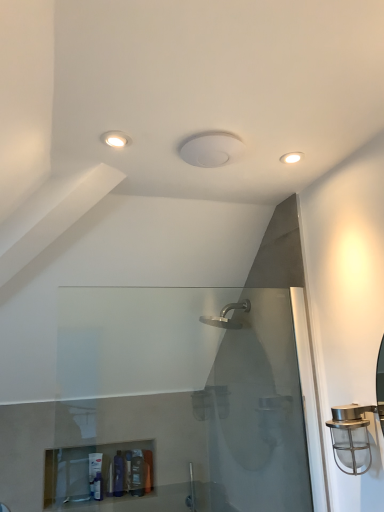
What do you see at coordinates (351, 438) in the screenshot? I see `metallic cage at right` at bounding box center [351, 438].

What do you see at coordinates (116, 139) in the screenshot? I see `matte white recessed light at upper left, which is the second light fixture from right to left` at bounding box center [116, 139].

Locate an element on the screen. The image size is (384, 512). translucent plastic bottle at lower center, the first toiletry from the right is located at coordinates (148, 470).

Locate an element on the screen. metallic cage at right is located at coordinates (351, 438).

Between matte white recessed light at upper left, which is the 2th light fixture in back-to-front order, and translucent plastic tube at lower center, the second toiletry positioned from the left, which one has larger size?

With larger size is translucent plastic tube at lower center, the second toiletry positioned from the left.

You are a GUI agent. You are given a task and a screenshot of the screen. Output one action in this format:
    pyautogui.click(x=<x>, y=<y>)
    Task: Click on the 1st toiletry behind the matte white recessed light at upper left, which ranks as the first light fixture in front-to-back order
    This screenshot has width=384, height=512.
    Given the screenshot: What is the action you would take?
    pyautogui.click(x=137, y=473)

Does point (110, 139) come farther from viewer compared to point (139, 492)?

That is False.

Is white matte light fixture at upper right, arranged as the 2th light fixture when viewed from the front, wider or thinner than translucent plastic bottle at lower center, the 3th toiletry positioned from the left?

In the image, white matte light fixture at upper right, arranged as the 2th light fixture when viewed from the front, appears to be more narrow than translucent plastic bottle at lower center, the 3th toiletry positioned from the left.

Which point is more distant from viewer, (292, 154) or (149, 463)?

The point (149, 463) is farther.

Who is more distant, white matte light fixture at upper right, which appears as the 2th light fixture when viewed from the left, or translucent plastic bottle at lower center, the 3th toiletry positioned from the left?

translucent plastic bottle at lower center, the 3th toiletry positioned from the left.

Looking at this image, from the image's perspective, is translucent plastic tube at lower center, the second toiletry positioned from the left, located above translucent plastic bottle at lower center, the 3th toiletry positioned from the left?

Yes, from the image's perspective, translucent plastic tube at lower center, the second toiletry positioned from the left, is on top of translucent plastic bottle at lower center, the 3th toiletry positioned from the left.

Identify the location of toiletry below the translucent plastic bottle at lower center, the first toiletry from the right (from a real-world perspective). (137, 473).

Considering the sizes of translucent plastic tube at lower center, which is the 2th toiletry from right to left, and translucent plastic bottle at lower center, the first toiletry from the right, in the image, is translucent plastic tube at lower center, which is the 2th toiletry from right to left, wider or thinner than translucent plastic bottle at lower center, the first toiletry from the right,?

translucent plastic tube at lower center, which is the 2th toiletry from right to left, is thinner than translucent plastic bottle at lower center, the first toiletry from the right.

Based on the photo, which is closer, (x=139, y=478) or (x=144, y=483)?

Point (x=139, y=478) is farther from the camera than point (x=144, y=483).

Is matte white recessed light at upper left, which is the 2th light fixture in back-to-front order, completely or partially inside white matte light fixture at upper right, which is the 1th light fixture in back-to-front order?

That's incorrect, matte white recessed light at upper left, which is the 2th light fixture in back-to-front order, is not inside white matte light fixture at upper right, which is the 1th light fixture in back-to-front order.

Can you tell me how much white matte light fixture at upper right, which appears as the 2th light fixture when viewed from the left, and matte white recessed light at upper left, which is the 2th light fixture in back-to-front order, differ in facing direction?

0.688 degrees separate the facing orientations of white matte light fixture at upper right, which appears as the 2th light fixture when viewed from the left, and matte white recessed light at upper left, which is the 2th light fixture in back-to-front order.

Who is shorter, white matte light fixture at upper right, placed as the first light fixture when sorted from right to left, or matte white recessed light at upper left, which is the second light fixture from right to left?

white matte light fixture at upper right, placed as the first light fixture when sorted from right to left, is shorter.

Can you confirm if white matte light fixture at upper right, arranged as the 2th light fixture when viewed from the front, is positioned to the right of matte white recessed light at upper left, which is the 2th light fixture in back-to-front order?

Yes.

Which of these two, metallic cage at right or white matte light fixture at upper right, which is the 1th light fixture in back-to-front order, is thinner?

With smaller width is white matte light fixture at upper right, which is the 1th light fixture in back-to-front order.

From the image's perspective, which is above, metallic cage at right or white matte light fixture at upper right, placed as the first light fixture when sorted from right to left?

white matte light fixture at upper right, placed as the first light fixture when sorted from right to left, from the image's perspective.

Considering the relative positions of metallic cage at right and white matte light fixture at upper right, placed as the first light fixture when sorted from right to left, in the image provided, is metallic cage at right to the right of white matte light fixture at upper right, placed as the first light fixture when sorted from right to left, from the viewer's perspective?

Correct, you'll find metallic cage at right to the right of white matte light fixture at upper right, placed as the first light fixture when sorted from right to left.

From the image's perspective, is translucent plastic tube at lower center, which is the 2th toiletry from right to left, above or below metallic cage at right?

Based on their image positions, translucent plastic tube at lower center, which is the 2th toiletry from right to left, is located beneath metallic cage at right.

Considering the positions of objects translucent plastic tube at lower center, which is the 2th toiletry from right to left, and metallic cage at right in the image provided, who is more to the right, translucent plastic tube at lower center, which is the 2th toiletry from right to left, or metallic cage at right?

From the viewer's perspective, metallic cage at right appears more on the right side.

Is point (136, 485) less distant than point (348, 410)?

No, it is behind (348, 410).

From the image's perspective, which is below, matte white recessed light at upper left, the first light fixture when ordered from left to right, or white matte light fixture at upper right, placed as the first light fixture when sorted from right to left?

white matte light fixture at upper right, placed as the first light fixture when sorted from right to left, appears lower in the image.

Does matte white recessed light at upper left, which is the second light fixture from right to left, have a greater width compared to white matte light fixture at upper right, arranged as the 2th light fixture when viewed from the front?

Indeed, matte white recessed light at upper left, which is the second light fixture from right to left, has a greater width compared to white matte light fixture at upper right, arranged as the 2th light fixture when viewed from the front.

Is matte white recessed light at upper left, which is the second light fixture from right to left, outside of white matte light fixture at upper right, which appears as the 2th light fixture when viewed from the left?

That's correct, matte white recessed light at upper left, which is the second light fixture from right to left, is outside of white matte light fixture at upper right, which appears as the 2th light fixture when viewed from the left.

From a real-world perspective, is matte white recessed light at upper left, which ranks as the first light fixture in front-to-back order, physically below white matte light fixture at upper right, which appears as the 2th light fixture when viewed from the left?

Yes, from a real-world perspective, matte white recessed light at upper left, which ranks as the first light fixture in front-to-back order, is beneath white matte light fixture at upper right, which appears as the 2th light fixture when viewed from the left.

This screenshot has height=512, width=384. In order to click on the 1st toiletry below the matte white recessed light at upper left, which ranks as the first light fixture in front-to-back order (from the image's perspective) in this screenshot , I will do `click(137, 473)`.

From the translucent plastic bottle at lower center, the first toiletry from the right, count 2nd light fixture to the right and point to it. Please provide its 2D coordinates.

[(291, 157)]

Based on their spatial positions, is translucent plastic tube at lower center, which is the 2th toiletry from right to left, or metallic cage at right further from white matte light fixture at upper right, which appears as the 2th light fixture when viewed from the left?

Based on the image, translucent plastic tube at lower center, which is the 2th toiletry from right to left, appears to be further to white matte light fixture at upper right, which appears as the 2th light fixture when viewed from the left.

When comparing their distances from translucent plastic bottle at lower left, the third toiletry in the right-to-left sequence, does metallic cage at right or translucent plastic bottle at lower center, the 3th toiletry positioned from the left, seem further?

metallic cage at right is positioned further to the anchor translucent plastic bottle at lower left, the third toiletry in the right-to-left sequence.

Estimate the real-world distances between objects in this image. Which object is further from white matte light fixture at upper right, which is the 1th light fixture in back-to-front order, translucent plastic bottle at lower center, the 3th toiletry positioned from the left, or matte white recessed light at upper left, which is the 2th light fixture in back-to-front order?

translucent plastic bottle at lower center, the 3th toiletry positioned from the left, is positioned further to the anchor white matte light fixture at upper right, which is the 1th light fixture in back-to-front order.

Estimate the real-world distances between objects in this image. Which object is further from translucent plastic bottle at lower left, the third toiletry in the right-to-left sequence, translucent plastic bottle at lower center, the first toiletry from the right, or matte white recessed light at upper left, which is the 2th light fixture in back-to-front order?

matte white recessed light at upper left, which is the 2th light fixture in back-to-front order, is further to translucent plastic bottle at lower left, the third toiletry in the right-to-left sequence.

Consider the image. When comparing their distances from translucent plastic bottle at lower left, the 1th toiletry when ordered from left to right, does white matte light fixture at upper right, placed as the first light fixture when sorted from right to left, or translucent plastic bottle at lower center, the 3th toiletry positioned from the left, seem closer?

translucent plastic bottle at lower center, the 3th toiletry positioned from the left, lies closer to translucent plastic bottle at lower left, the 1th toiletry when ordered from left to right, than the other object.

Based on their spatial positions, is translucent plastic bottle at lower center, the 3th toiletry positioned from the left, or metallic cage at right closer to translucent plastic bottle at lower left, the third toiletry in the right-to-left sequence?

The object closer to translucent plastic bottle at lower left, the third toiletry in the right-to-left sequence, is translucent plastic bottle at lower center, the 3th toiletry positioned from the left.

From the picture: When comparing their distances from translucent plastic bottle at lower center, the 3th toiletry positioned from the left, does translucent plastic bottle at lower left, the third toiletry in the right-to-left sequence, or matte white recessed light at upper left, which is the 2th light fixture in back-to-front order, seem further?

Based on the image, matte white recessed light at upper left, which is the 2th light fixture in back-to-front order, appears to be further to translucent plastic bottle at lower center, the 3th toiletry positioned from the left.

When comparing their distances from translucent plastic bottle at lower center, the first toiletry from the right, does metallic cage at right or white matte light fixture at upper right, which is the 1th light fixture in back-to-front order, seem closer?

metallic cage at right.

Image resolution: width=384 pixels, height=512 pixels. In order to click on lamp between matte white recessed light at upper left, which ranks as the first light fixture in front-to-back order, and translucent plastic bottle at lower left, the 1th toiletry when ordered from left to right, from top to bottom in this screenshot , I will do `click(351, 438)`.

Find the location of a particular element. lamp between white matte light fixture at upper right, which is the 1th light fixture in back-to-front order, and translucent plastic bottle at lower center, the first toiletry from the right, in the vertical direction is located at coordinates (351, 438).

You are a GUI agent. You are given a task and a screenshot of the screen. Output one action in this format:
    pyautogui.click(x=<x>, y=<y>)
    Task: Click on the lamp between white matte light fixture at upper right, which appears as the 2th light fixture when viewed from the left, and translucent plastic bottle at lower left, the 1th toiletry when ordered from left to right, in the vertical direction
    This screenshot has width=384, height=512.
    Given the screenshot: What is the action you would take?
    pos(351,438)

Where is `toiletry between matte white recessed light at upper left, the first light fixture when ordered from left to right, and translucent plastic bottle at lower left, the third toiletry in the right-to-left sequence, vertically`? Image resolution: width=384 pixels, height=512 pixels. toiletry between matte white recessed light at upper left, the first light fixture when ordered from left to right, and translucent plastic bottle at lower left, the third toiletry in the right-to-left sequence, vertically is located at coordinates (137, 473).